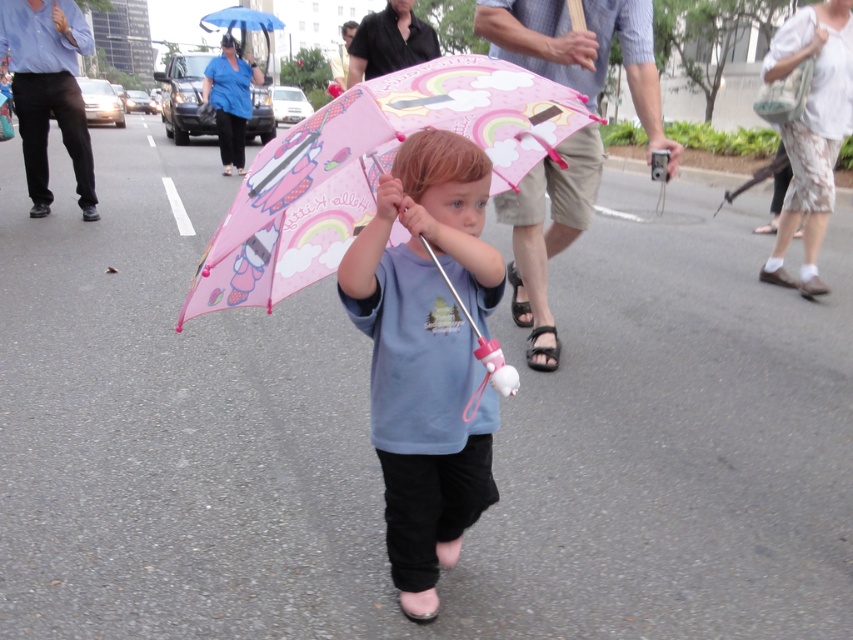
Is pink matte umbrella at center above white fabric bag at upper right?

No, pink matte umbrella at center is not above white fabric bag at upper right.

Does pink matte umbrella at center have a smaller size compared to white fabric bag at upper right?

Correct, pink matte umbrella at center occupies less space than white fabric bag at upper right.

Locate an element on the screen. The width and height of the screenshot is (853, 640). pink matte umbrella at center is located at coordinates (368, 170).

Can you confirm if matte pink umbrella at center is positioned to the right of pink matte umbrella at center?

Correct, you'll find matte pink umbrella at center to the right of pink matte umbrella at center.

In the scene shown: Does matte pink umbrella at center appear under pink matte umbrella at center?

Correct, matte pink umbrella at center is located below pink matte umbrella at center.

Between point (469, 172) and point (248, 205), which one is positioned behind?

Positioned behind is point (469, 172).

Locate an element on the screen. The height and width of the screenshot is (640, 853). matte pink umbrella at center is located at coordinates (426, 353).

Does matte pink umbrella at center have a larger size compared to pink fabric umbrella at upper center?

Incorrect, matte pink umbrella at center is not larger than pink fabric umbrella at upper center.

Between point (432, 424) and point (553, 236), which one is positioned in front?

Point (432, 424) is in front.

Who is more forward, (445, 348) or (494, 26)?

Positioned in front is point (445, 348).

Where is `matte pink umbrella at center`? The height and width of the screenshot is (640, 853). matte pink umbrella at center is located at coordinates (426, 353).